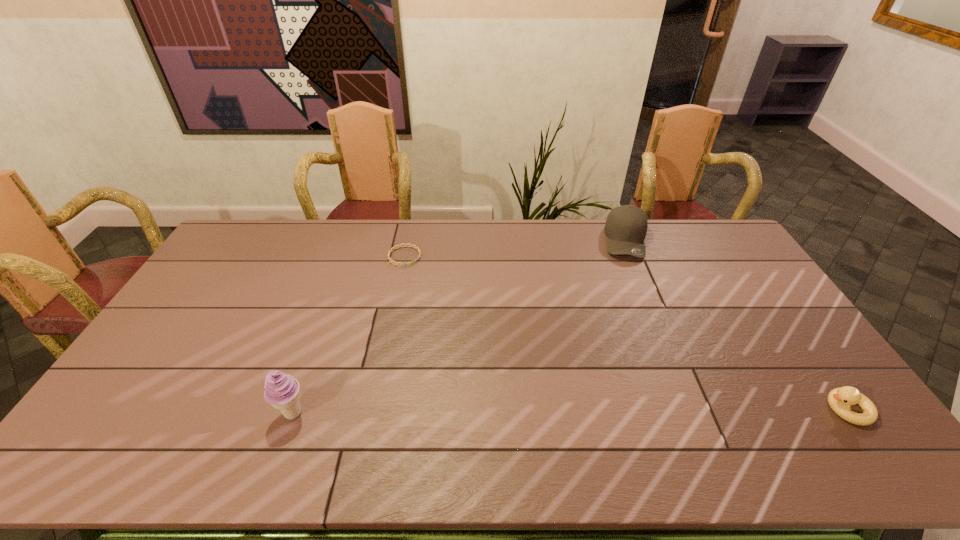
Image resolution: width=960 pixels, height=540 pixels. What are the coordinates of `vacant spot on the desktop that is between the leftmost object and the duckling and is positioned on the front brim of the third shortest object` in the screenshot? It's located at (648, 410).

Locate an element on the screen. The width and height of the screenshot is (960, 540). free space on the desktop that is between the icecream and the second shortest object and is positioned on the surface of the shortest object showing star-shaped elements is located at coordinates (581, 411).